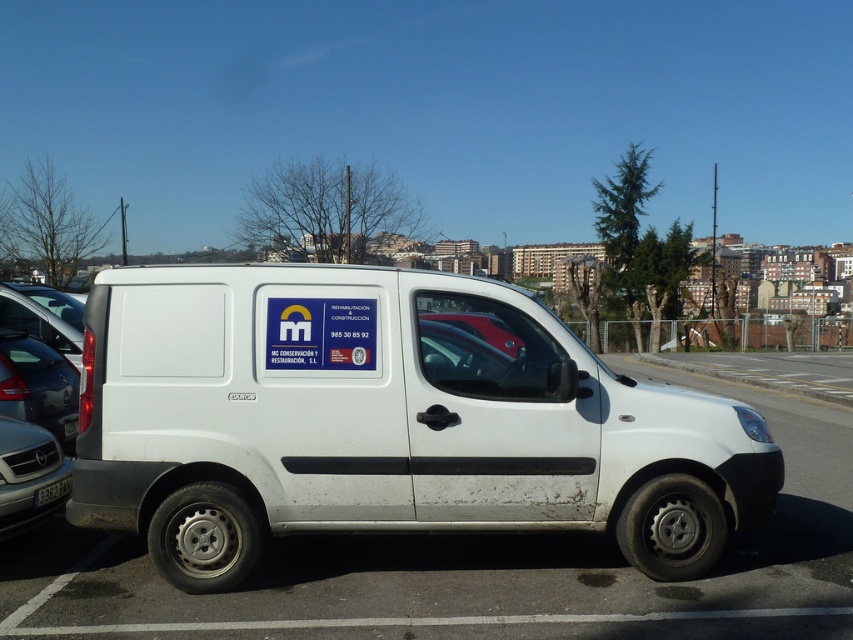
Question: Which object is the closest to the white matte van at center?

Choices:
 (A) black plastic license plate at lower left
 (B) silver metallic car at lower left

Answer: (B)

Question: Is white matte van at center bigger than silver metallic car at lower left?

Choices:
 (A) no
 (B) yes

Answer: (B)

Question: In this image, where is silver metallic car at lower left located relative to black plastic license plate at lower left?

Choices:
 (A) below
 (B) above

Answer: (B)

Question: Which object is positioned farthest from the silver metallic car at lower left?

Choices:
 (A) black plastic license plate at lower left
 (B) white matte van at center

Answer: (B)

Question: Does white matte van at center have a smaller size compared to black plastic license plate at lower left?

Choices:
 (A) no
 (B) yes

Answer: (A)

Question: Which object is the farthest from the white matte van at center?

Choices:
 (A) black plastic license plate at lower left
 (B) silver metallic car at lower left

Answer: (A)